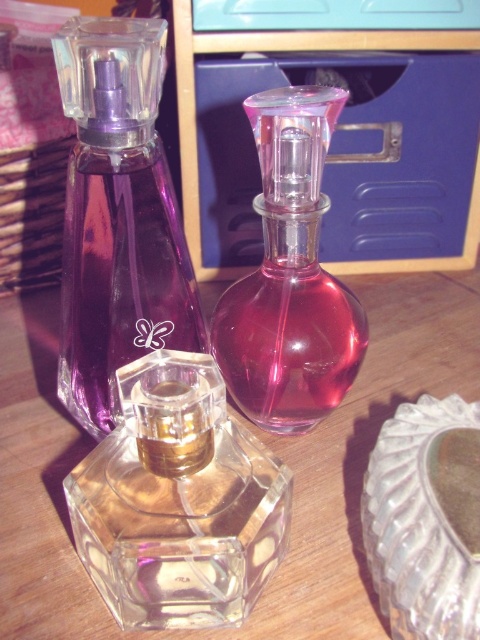
You are holding a ruler and want to measure the distance between the purple glass perfume at center and the edge of the wooden surface it is placed on. However, you can only measure up to 12 inches. Can you accurately measure the distance using your ruler?

The purple glass perfume at center is 12.14 inches away from the viewer, which exceeds your ruler maximum capacity of 12 inches. Therefore, you cannot accurately measure the distance with your current ruler.

You are organizing a perfume display and need to know the arrangement of the transparent glass perfume at center and the purple glass perfume at center. Which one is closer to the viewer?

The transparent glass perfume at center is closer to the viewer as it is in front of the purple glass perfume at center.

Based on the photo, you are organizing a perfume display and need to know the arrangement of the transparent glass perfume bottle at center and the pink glass perfume at center. Which one is closer to you?

The transparent glass perfume bottle at center is closer to you because it is in front of the pink glass perfume at center.